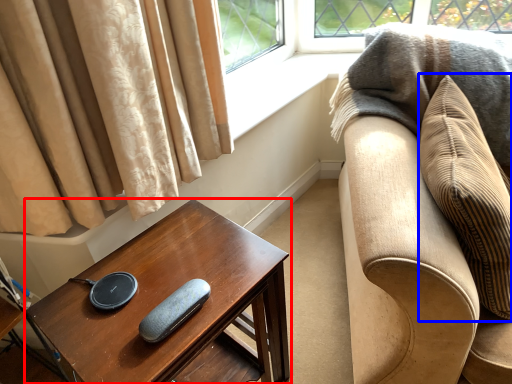
Question: Which of the following is the closest to the observer, table (highlighted by a red box) or pillow (highlighted by a blue box)?

Choices:
 (A) table
 (B) pillow

Answer: (B)